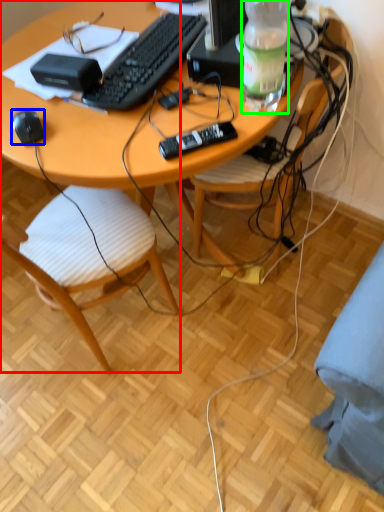
Question: Which is nearer to the chair (highlighted by a red box)? computer mouse (highlighted by a blue box) or bottle (highlighted by a green box).

Choices:
 (A) computer mouse
 (B) bottle

Answer: (A)